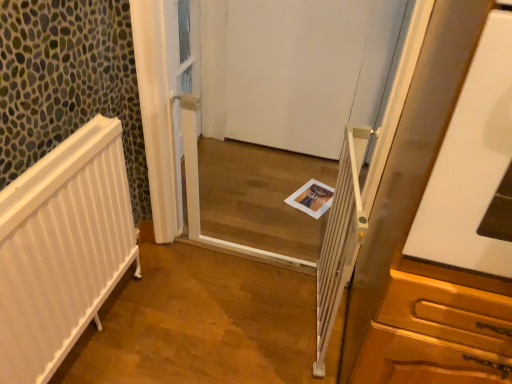
Question: Is white paper magazine at center inside or outside of white matte door at center?

Choices:
 (A) inside
 (B) outside

Answer: (B)

Question: Based on their sizes in the image, would you say white paper magazine at center is bigger or smaller than white matte door at center?

Choices:
 (A) small
 (B) big

Answer: (A)

Question: Which object is positioned farthest from the white matte door at center?

Choices:
 (A) white plastic screen door at center
 (B) white matte radiator at left
 (C) white plastic balustrade at center
 (D) white paper magazine at center

Answer: (B)

Question: Which of these objects is positioned closest to the white matte radiator at left?

Choices:
 (A) white paper magazine at center
 (B) white matte door at center
 (C) white plastic balustrade at center
 (D) white plastic screen door at center

Answer: (C)